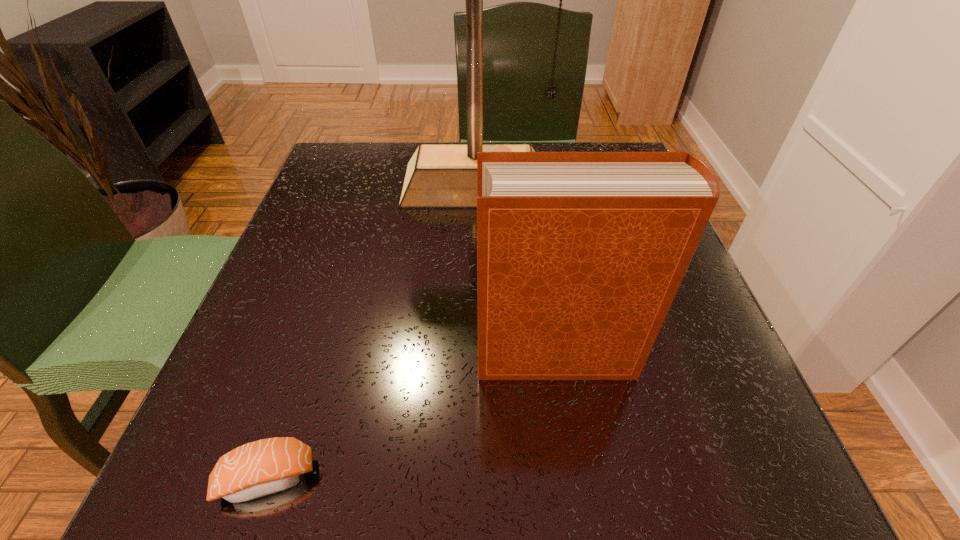
Locate an element on the screen. This screenshot has width=960, height=540. table lamp is located at coordinates (439, 176).

I want to click on the farthest object, so click(x=439, y=176).

Where is `the second shortest object`? Image resolution: width=960 pixels, height=540 pixels. the second shortest object is located at coordinates (580, 255).

This screenshot has height=540, width=960. Find the location of `the second nearest object`. the second nearest object is located at coordinates (580, 255).

The height and width of the screenshot is (540, 960). I want to click on the nearest object, so click(263, 467).

Identify the location of the leftmost object. (263, 467).

At what (x,y) coordinates should I click in order to perform the action: click on free spot located 0.380m on the metallic stand of the farthest object. Please return your answer as a coordinate pair (x, y). The image size is (960, 540). Looking at the image, I should click on (472, 394).

Image resolution: width=960 pixels, height=540 pixels. In order to click on free space located on the open cover of the second farthest object in this screenshot , I will do `click(337, 355)`.

Image resolution: width=960 pixels, height=540 pixels. Find the location of `free space located on the open cover of the second farthest object`. free space located on the open cover of the second farthest object is located at coordinates (431, 355).

In order to click on vacant region located on the open cover of the second farthest object in this screenshot , I will do `click(324, 355)`.